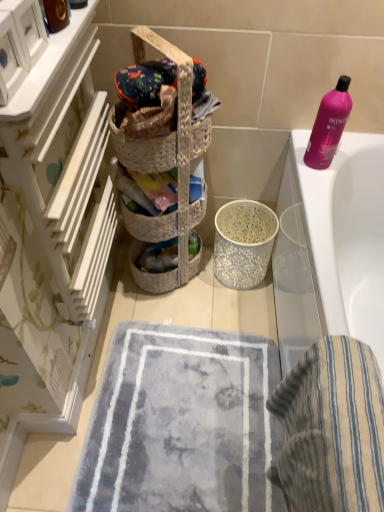
Question: Is white wood drawers at left to the right of soft gray carpet at center from the viewer's perspective?

Choices:
 (A) yes
 (B) no

Answer: (B)

Question: Is white wood drawers at left with soft gray carpet at center?

Choices:
 (A) yes
 (B) no

Answer: (B)

Question: Is white wood drawers at left oriented towards soft gray carpet at center?

Choices:
 (A) no
 (B) yes

Answer: (A)

Question: From the image's perspective, is white wood drawers at left on top of soft gray carpet at center?

Choices:
 (A) yes
 (B) no

Answer: (A)

Question: Is white wood drawers at left positioned in front of soft gray carpet at center?

Choices:
 (A) yes
 (B) no

Answer: (A)

Question: Choose the correct answer: Is pink plastic bottle at upper right inside white wood drawers at left or outside it?

Choices:
 (A) outside
 (B) inside

Answer: (A)

Question: Considering the relative positions of pink plastic bottle at upper right and white wood drawers at left in the image provided, is pink plastic bottle at upper right to the left or to the right of white wood drawers at left?

Choices:
 (A) right
 (B) left

Answer: (A)

Question: Does point (336, 147) appear closer or farther from the camera than point (51, 202)?

Choices:
 (A) closer
 (B) farther

Answer: (B)

Question: From the image's perspective, is pink plastic bottle at upper right located above or below white wood drawers at left?

Choices:
 (A) above
 (B) below

Answer: (A)

Question: Is soft gray carpet at center to the left or to the right of white wood drawers at left in the image?

Choices:
 (A) right
 (B) left

Answer: (A)

Question: Based on their sizes in the image, would you say soft gray carpet at center is bigger or smaller than white wood drawers at left?

Choices:
 (A) small
 (B) big

Answer: (A)

Question: From the image's perspective, relative to white wood drawers at left, is soft gray carpet at center above or below?

Choices:
 (A) below
 (B) above

Answer: (A)

Question: From their relative heights in the image, would you say soft gray carpet at center is taller or shorter than white wood drawers at left?

Choices:
 (A) tall
 (B) short

Answer: (B)

Question: Is white wood drawers at left inside or outside of white glossy bathtub at upper right?

Choices:
 (A) outside
 (B) inside

Answer: (A)

Question: From a real-world perspective, is white wood drawers at left above or below white glossy bathtub at upper right?

Choices:
 (A) above
 (B) below

Answer: (A)